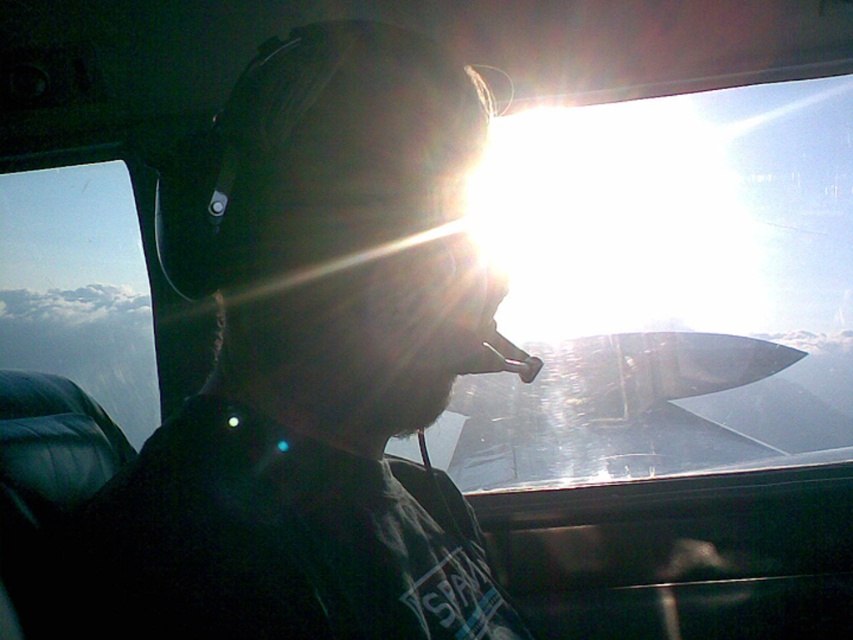
You are a passenger in the aircraft and want to put on the black matte helmet at center before the flight. Is there enough space between the helmet and the transparent glass airplane window at upper center to avoid hitting your head?

The black matte helmet at center is smaller than the transparent glass airplane window at upper center, so there should be enough space to put on the helmet without hitting your head against the window.

You are a passenger in the aircraft and want to look outside through the transparent glass airplane window at upper center. However, there is a black matte helmet at center blocking your view. Can you see the window clearly from your current position?

The black matte helmet at center is in front of the transparent glass airplane window at upper center, so it is blocking your view. Move the black matte helmet at center out of the way to see the window clearly.

You are a passenger in the cockpit and need to put on the black matte helmet at center before the flight. However, you notice the transparent glass airplane window at upper center is in your way. Can you move the helmet to the right to avoid the window?

The black matte helmet at center is to the left of the transparent glass airplane window at upper center. Since the helmet is already positioned to the left of the window, moving it further to the right would bring it closer to the window, which might not help. You might need to adjust your approach to access the helmet without obstructing the window.